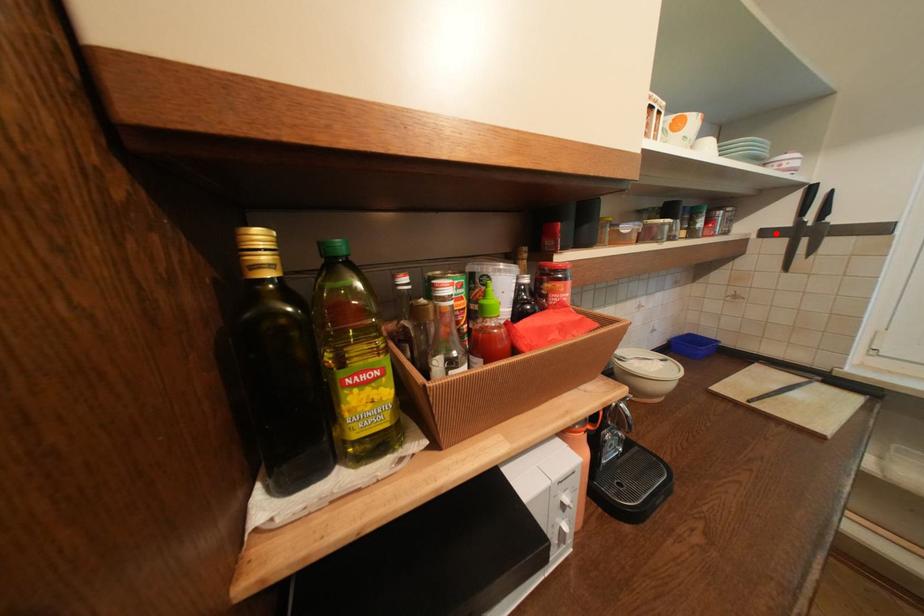
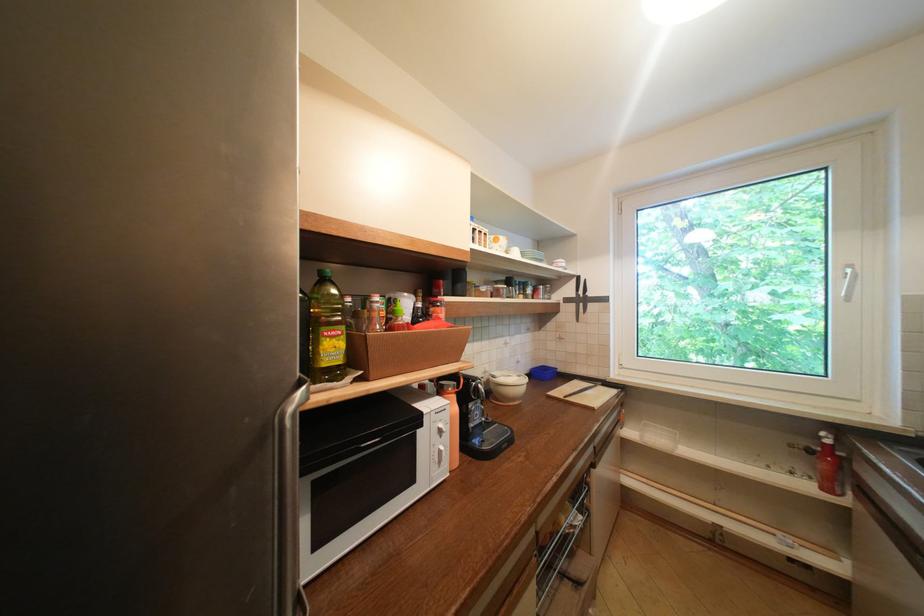
The point at the highlighted location is marked in the first image. Where is the corresponding point in the second image?

(575, 301)